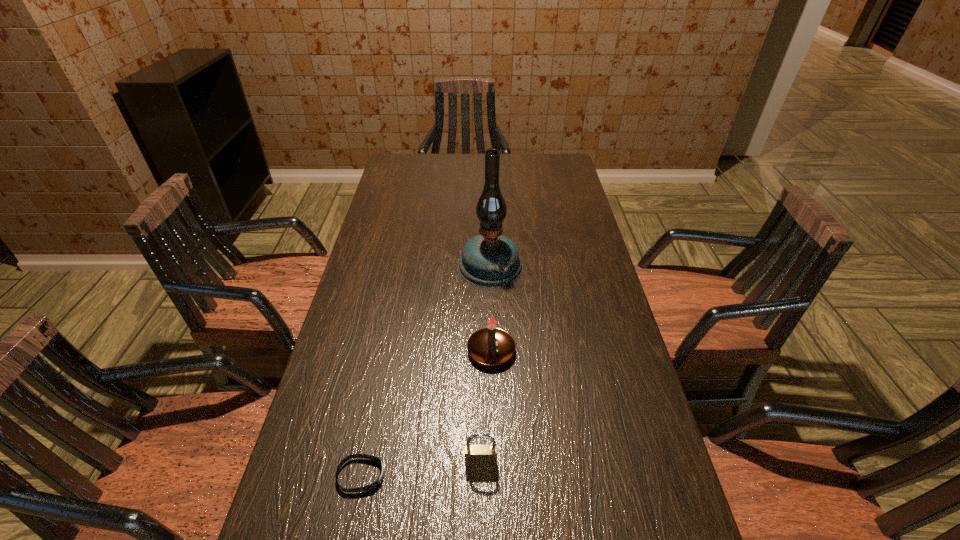
Where is `object that is positioned at the left edge`? The width and height of the screenshot is (960, 540). object that is positioned at the left edge is located at coordinates (372, 486).

Identify the location of free location at the far edge of the desktop. (444, 173).

Locate an element on the screen. free location at the left edge of the desktop is located at coordinates (412, 212).

Image resolution: width=960 pixels, height=540 pixels. In order to click on vacant space at the right edge of the desktop in this screenshot , I will do `click(657, 471)`.

Find the location of a particular element. free space at the far right corner is located at coordinates (571, 181).

Where is `unoccupied position between the leftmost object and the second farthest object`? The image size is (960, 540). unoccupied position between the leftmost object and the second farthest object is located at coordinates (426, 413).

Find the location of a particular element. vacant space that's between the shortest object and the candle is located at coordinates 426,413.

Locate an element on the screen. vacant region between the padlock and the leftmost object is located at coordinates (421, 469).

Locate an element on the screen. vacant space that is in between the tallest object and the second farthest object is located at coordinates (491, 308).

This screenshot has width=960, height=540. I want to click on free point between the candle and the third tallest object, so click(486, 407).